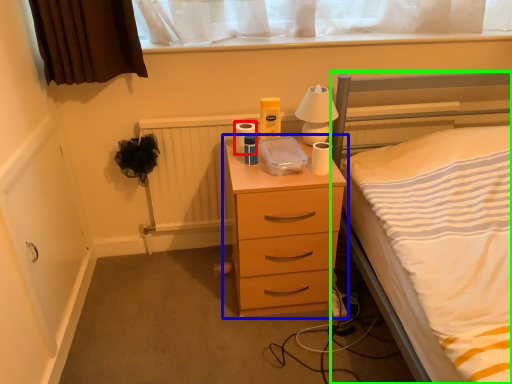
Question: Which is farther away from toilet paper (highlighted by a red box)? chest of drawers (highlighted by a blue box) or bed (highlighted by a green box)?

Choices:
 (A) chest of drawers
 (B) bed

Answer: (B)